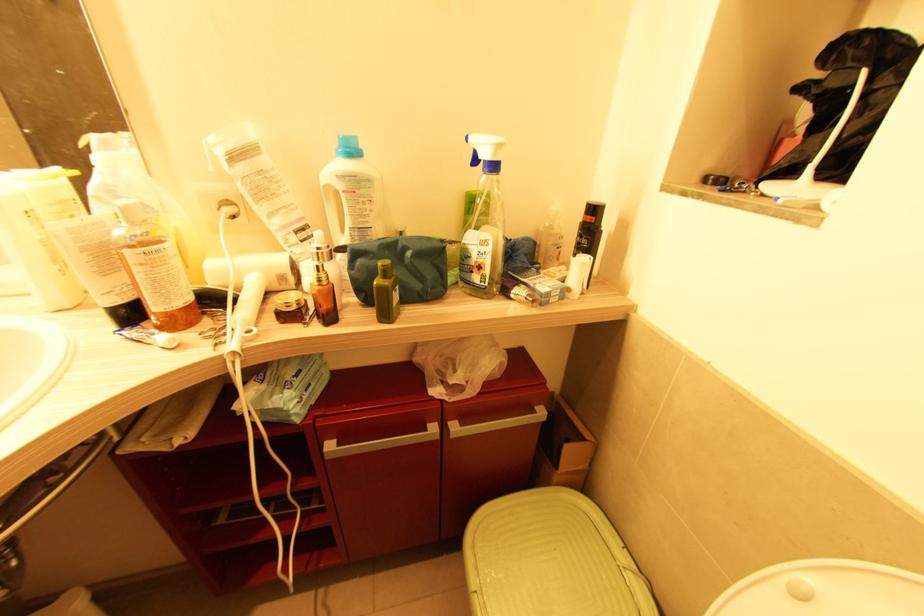
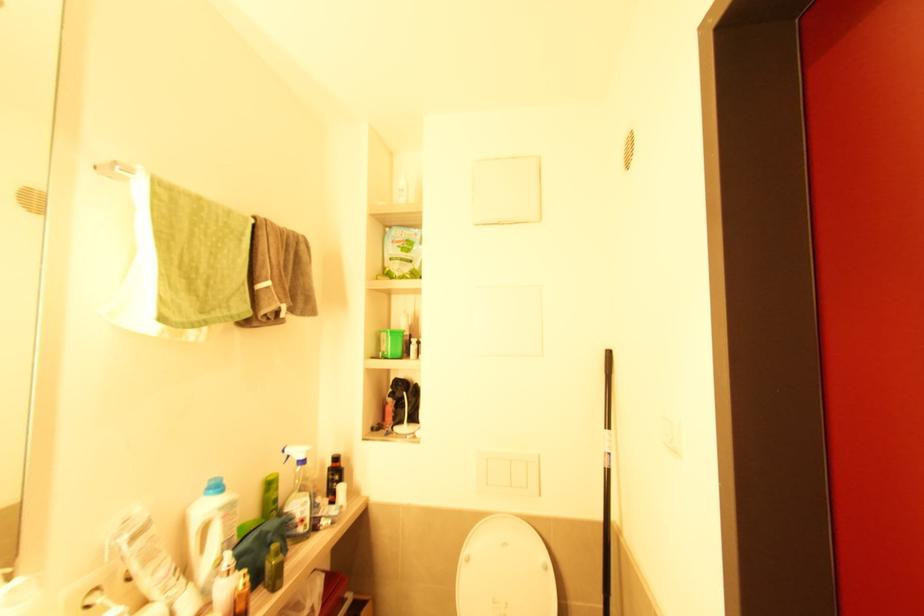
In the second image, find the point that corresponds to (x=473, y=273) in the first image.

(298, 527)